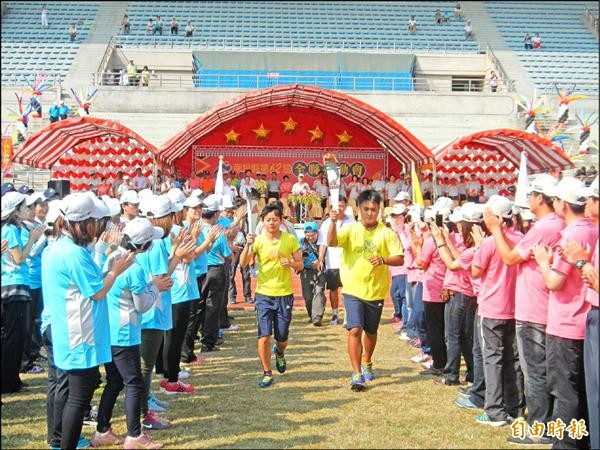
The width and height of the screenshot is (600, 450). Find the location of `stage`. stage is located at coordinates (297, 226).